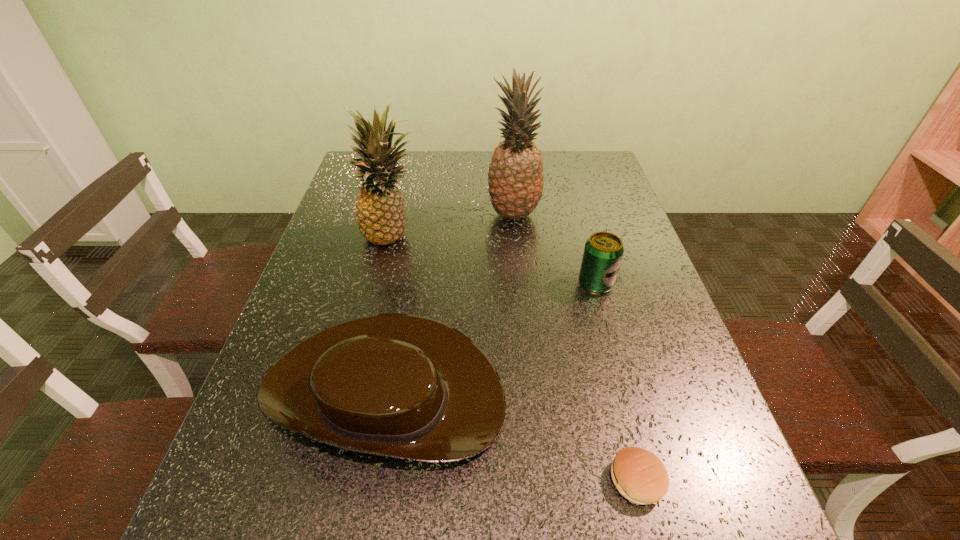
Locate an element on the screen. free spot between the right pineapple and the patty is located at coordinates (575, 347).

The width and height of the screenshot is (960, 540). In order to click on object that is the third closest to the cowboy hat in this screenshot , I will do `click(381, 217)`.

Locate which object is the second closest to the right pineapple. Please provide its 2D coordinates. Your answer should be formatted as a tuple, i.e. [(x, y)], where the tuple contains the x and y coordinates of a point satisfying the conditions above.

[(603, 252)]

This screenshot has height=540, width=960. I want to click on free spot that satisfies the following two spatial constraints: 1. on the front side of the right pineapple; 2. on the left side of the patty, so click(x=540, y=480).

You are a GUI agent. You are given a task and a screenshot of the screen. Output one action in this format:
    pyautogui.click(x=<x>, y=<y>)
    Task: Click on the free location that satisfies the following two spatial constraints: 1. on the back side of the right pineapple; 2. on the right side of the left pineapple
    This screenshot has height=540, width=960.
    Given the screenshot: What is the action you would take?
    pyautogui.click(x=397, y=215)

Find the location of a particular element. free space that satisfies the following two spatial constraints: 1. on the front side of the beer can; 2. on the left side of the left pineapple is located at coordinates (381, 284).

This screenshot has width=960, height=540. In order to click on vacant area in the image that satisfies the following two spatial constraints: 1. on the front side of the left pineapple; 2. on the right side of the shortest object in this screenshot , I will do `click(334, 480)`.